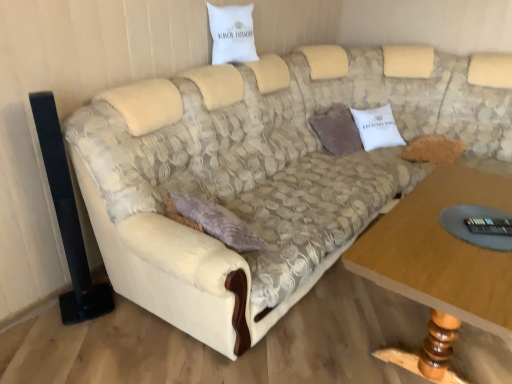
Find the location of `free space on the front side of transparent glass remote control at lower right`. free space on the front side of transparent glass remote control at lower right is located at coordinates [479, 271].